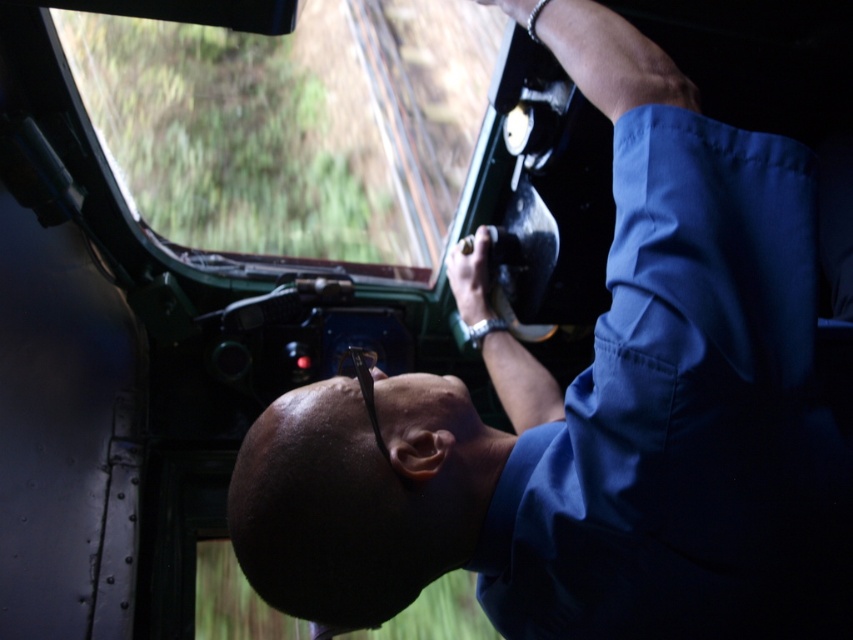
Who is more forward, (x=369, y=381) or (x=432, y=214)?

Point (x=369, y=381) is in front.

Between black matte head at center and metallic silver train track at upper center, which one appears on the left side from the viewer's perspective?

metallic silver train track at upper center

The width and height of the screenshot is (853, 640). Describe the element at coordinates (361, 493) in the screenshot. I see `black matte head at center` at that location.

Where is `black matte head at center`? The height and width of the screenshot is (640, 853). black matte head at center is located at coordinates (361, 493).

Based on the photo, does blue fabric shirt at center appear over metallic silver train track at upper center?

No, blue fabric shirt at center is not above metallic silver train track at upper center.

Is point (579, 394) in front of point (355, 35)?

Yes, point (579, 394) is in front of point (355, 35).

I want to click on blue fabric shirt at center, so click(593, 412).

Which of these two, blue fabric shirt at center or black matte head at center, stands taller?

blue fabric shirt at center is taller.

Does blue fabric shirt at center lie behind black matte head at center?

No, blue fabric shirt at center is closer to the viewer.

Find the location of `blue fabric shirt at center`. blue fabric shirt at center is located at coordinates (593, 412).